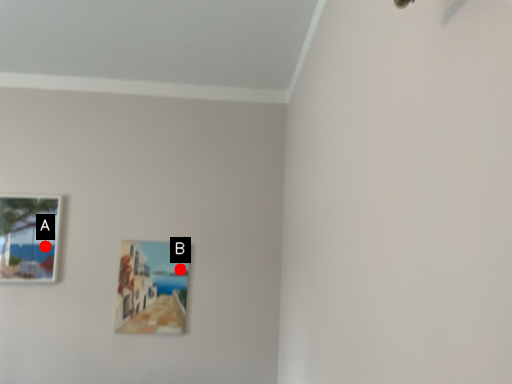
Question: Two points are circled on the image, labeled by A and B beside each circle. Which point is closer to the camera?

Choices:
 (A) A is closer
 (B) B is closer

Answer: (A)